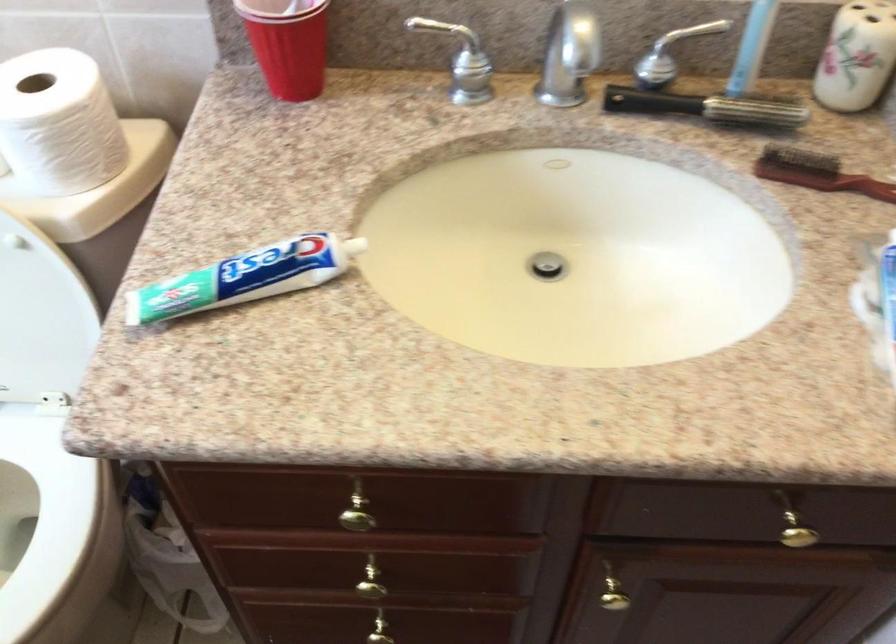
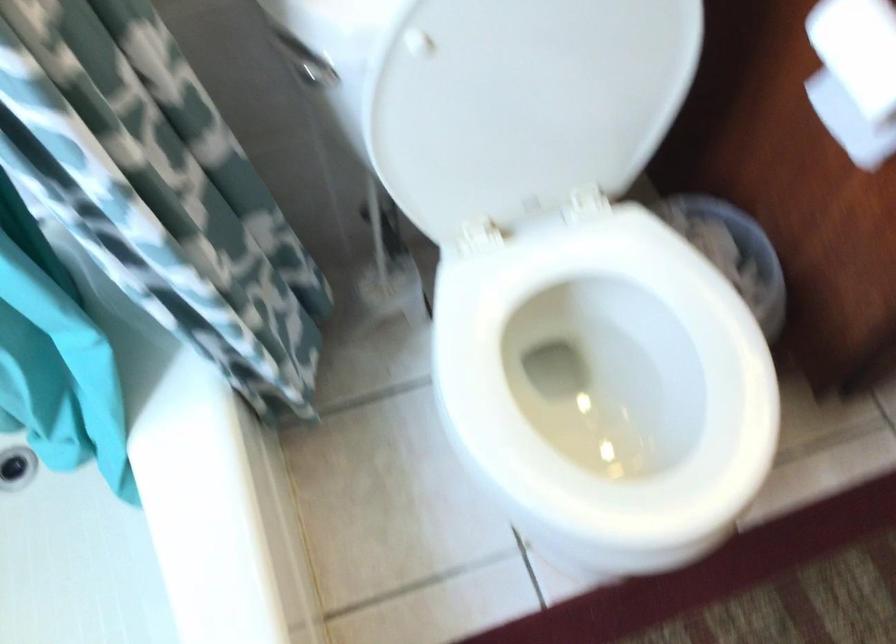
Question: Based on the continuous images, in which direction is the camera rotating? Reply with the corresponding letter.

Choices:
 (A) Left
 (B) Right
 (C) Up
 (D) Down

Answer: (D)